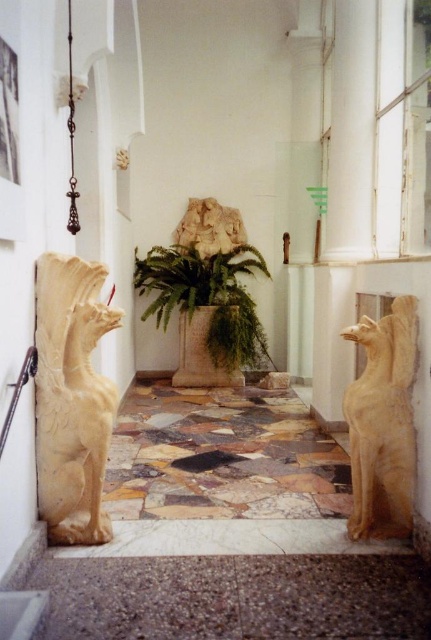
Which is more to the left, matte stone gargoyle at right or white marble lion at center?

white marble lion at center is more to the left.

Who is more distant from viewer, (x=406, y=342) or (x=196, y=228)?

The point (x=196, y=228) is more distant.

You are a GUI agent. You are given a task and a screenshot of the screen. Output one action in this format:
    pyautogui.click(x=<x>, y=<y>)
    Task: Click on the matte stone gargoyle at right
    Image resolution: width=431 pixels, height=640 pixels.
    Given the screenshot: What is the action you would take?
    pyautogui.click(x=383, y=422)

Based on the photo, does green leafy fern at center have a larger size compared to stone textured planter at center?

Yes, green leafy fern at center is bigger than stone textured planter at center.

Which is behind, point (212, 296) or point (197, 352)?

The point (197, 352) is behind.

Describe the element at coordinates (206, 298) in the screenshot. The image size is (431, 640). I see `green leafy fern at center` at that location.

Image resolution: width=431 pixels, height=640 pixels. I want to click on green leafy fern at center, so click(206, 298).

Who is more forward, [344,412] or [196,317]?

Point [344,412] is more forward.

The width and height of the screenshot is (431, 640). What do you see at coordinates (383, 422) in the screenshot? I see `matte stone gargoyle at right` at bounding box center [383, 422].

Does point (362, 417) lie behind point (211, 371)?

No, (362, 417) is in front of (211, 371).

In order to click on matte stone gargoyle at right in this screenshot , I will do `click(383, 422)`.